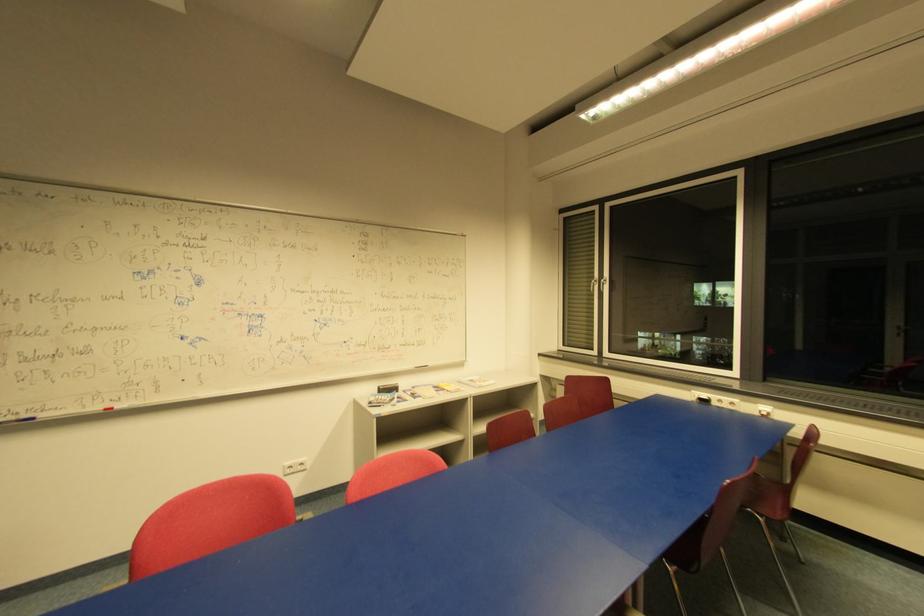
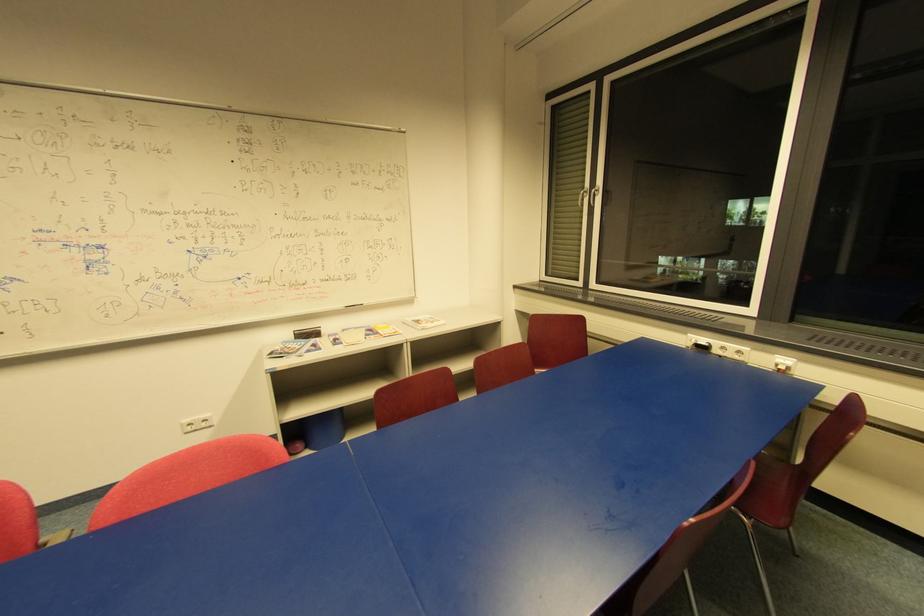
Which direction would the cameraman need to move to produce the second image?

The cameraman walked toward right, forward.